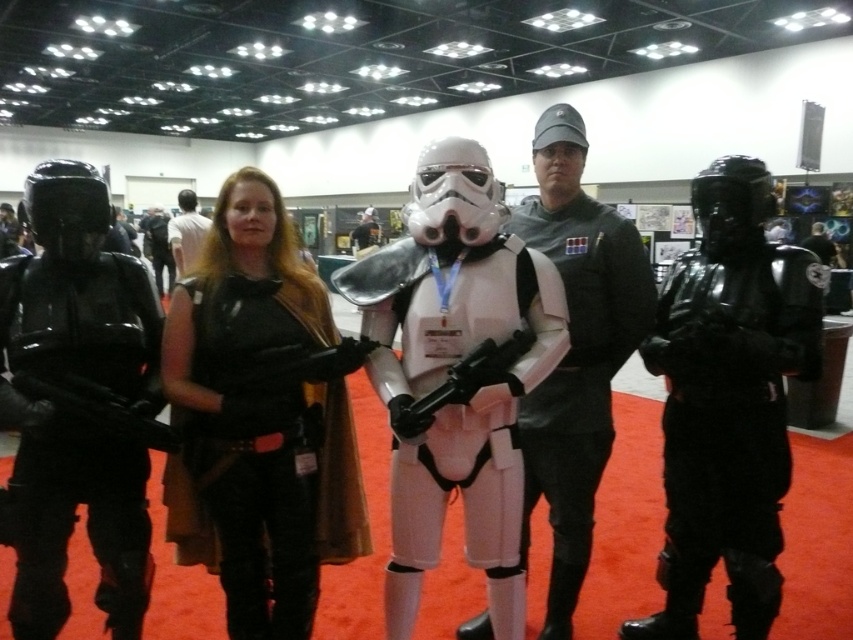
Does point (471, 378) lie behind point (167, 262)?

No, (471, 378) is in front of (167, 262).

Can you confirm if matte black gun at center is positioned above black matte armor at center?

No.

Who is more distant from viewer, [490,384] or [148,227]?

Point [148,227]

You are a GUI agent. You are given a task and a screenshot of the screen. Output one action in this format:
    pyautogui.click(x=<x>, y=<y>)
    Task: Click on the matte black gun at center
    The image size is (853, 640).
    Given the screenshot: What is the action you would take?
    pyautogui.click(x=461, y=384)

Which is more to the right, white matte stormtrooper at center or matte black gun at center?

From the viewer's perspective, matte black gun at center appears more on the right side.

Consider the image. Which is more to the left, white matte stormtrooper at center or matte black gun at center?

From the viewer's perspective, white matte stormtrooper at center appears more on the left side.

Is point (538, 259) farther from viewer compared to point (415, 413)?

Yes, it is.

Where is `white matte stormtrooper at center`? This screenshot has height=640, width=853. white matte stormtrooper at center is located at coordinates (451, 372).

Between shiny black armor at right and shiny black armor at left, which one is positioned higher?

shiny black armor at left is above.

Measure the distance between shiny black armor at right and camera.

shiny black armor at right is 5.93 feet away from camera.

Is point (735, 330) positioned before point (15, 627)?

Yes, it is.

Where is `shiny black armor at right`? The image size is (853, 640). shiny black armor at right is located at coordinates [x=728, y=401].